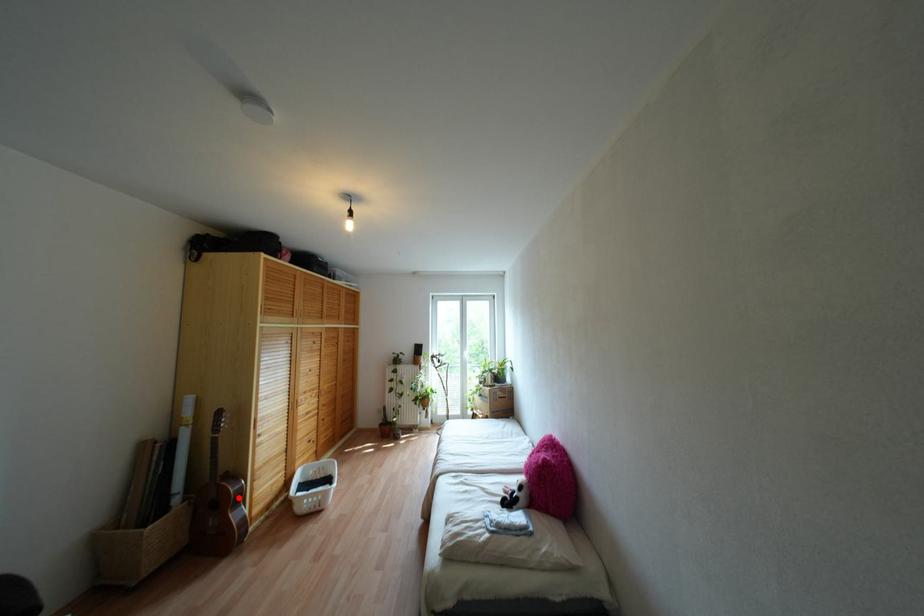
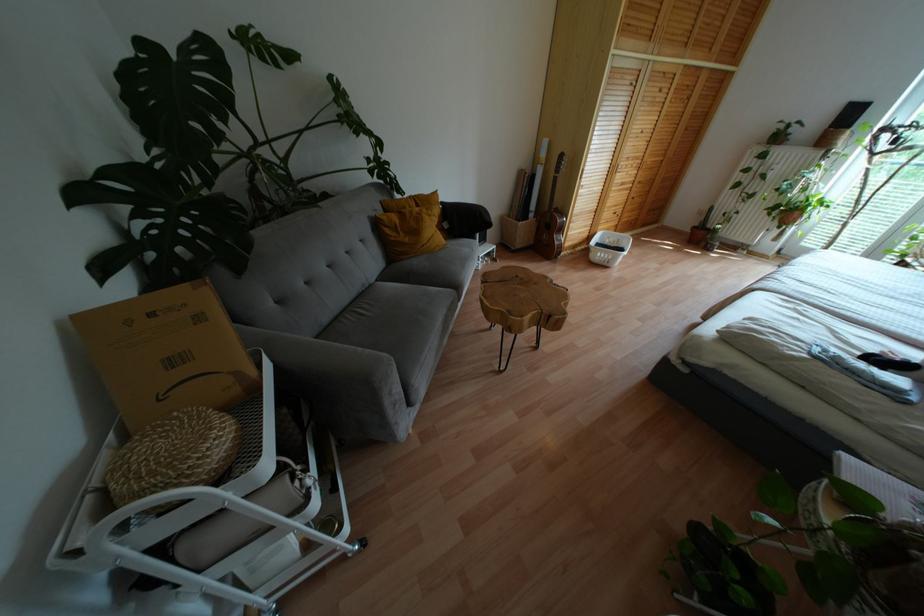
Find the pixel in the second image that matches the highlighted location in the first image.

(560, 229)